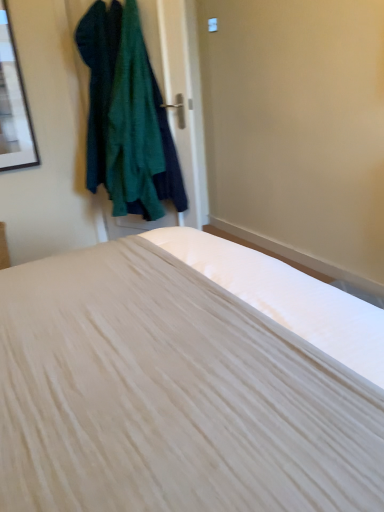
Question: Could you tell me if white matte bed at center is turned towards dark green textured sweater at upper left, which ranks as the first clothing in left-to-right order?

Choices:
 (A) yes
 (B) no

Answer: (B)

Question: Is white matte bed at center far from dark green textured sweater at upper left, which appears as the second clothing when viewed from the right?

Choices:
 (A) yes
 (B) no

Answer: (A)

Question: Is white matte bed at center to the left of dark green textured sweater at upper left, which ranks as the first clothing in left-to-right order, from the viewer's perspective?

Choices:
 (A) no
 (B) yes

Answer: (A)

Question: Is white matte bed at center thinner than dark green textured sweater at upper left, which appears as the second clothing when viewed from the right?

Choices:
 (A) yes
 (B) no

Answer: (B)

Question: Is white matte bed at center taller than dark green textured sweater at upper left, which appears as the second clothing when viewed from the right?

Choices:
 (A) yes
 (B) no

Answer: (A)

Question: From a real-world perspective, does white matte bed at center stand above dark green textured sweater at upper left, which appears as the second clothing when viewed from the right?

Choices:
 (A) yes
 (B) no

Answer: (B)

Question: Is dark green textured sweater at upper left, marked as the 1th clothing in a right-to-left arrangement, at the left side of dark green textured sweater at upper left, which ranks as the first clothing in left-to-right order?

Choices:
 (A) no
 (B) yes

Answer: (A)

Question: Is dark green textured sweater at upper left, which ranks as the second clothing in left-to-right order, thinner than dark green textured sweater at upper left, which ranks as the first clothing in left-to-right order?

Choices:
 (A) no
 (B) yes

Answer: (A)

Question: Considering the relative sizes of dark green textured sweater at upper left, marked as the 1th clothing in a right-to-left arrangement, and dark green textured sweater at upper left, which appears as the second clothing when viewed from the right, in the image provided, is dark green textured sweater at upper left, marked as the 1th clothing in a right-to-left arrangement, bigger than dark green textured sweater at upper left, which appears as the second clothing when viewed from the right,?

Choices:
 (A) yes
 (B) no

Answer: (A)

Question: Is dark green textured sweater at upper left, which ranks as the first clothing in left-to-right order, a part of dark green textured sweater at upper left, marked as the 1th clothing in a right-to-left arrangement?

Choices:
 (A) no
 (B) yes

Answer: (B)

Question: Is dark green textured sweater at upper left, marked as the 1th clothing in a right-to-left arrangement, positioned in front of dark green textured sweater at upper left, which ranks as the first clothing in left-to-right order?

Choices:
 (A) no
 (B) yes

Answer: (B)

Question: Does dark green textured sweater at upper left, marked as the 1th clothing in a right-to-left arrangement, have a smaller size compared to dark green textured sweater at upper left, which appears as the second clothing when viewed from the right?

Choices:
 (A) no
 (B) yes

Answer: (A)

Question: Could dark green textured sweater at upper left, marked as the 1th clothing in a right-to-left arrangement, be considered to be inside dark green textured sweater at upper left, which appears as the second clothing when viewed from the right?

Choices:
 (A) no
 (B) yes

Answer: (A)